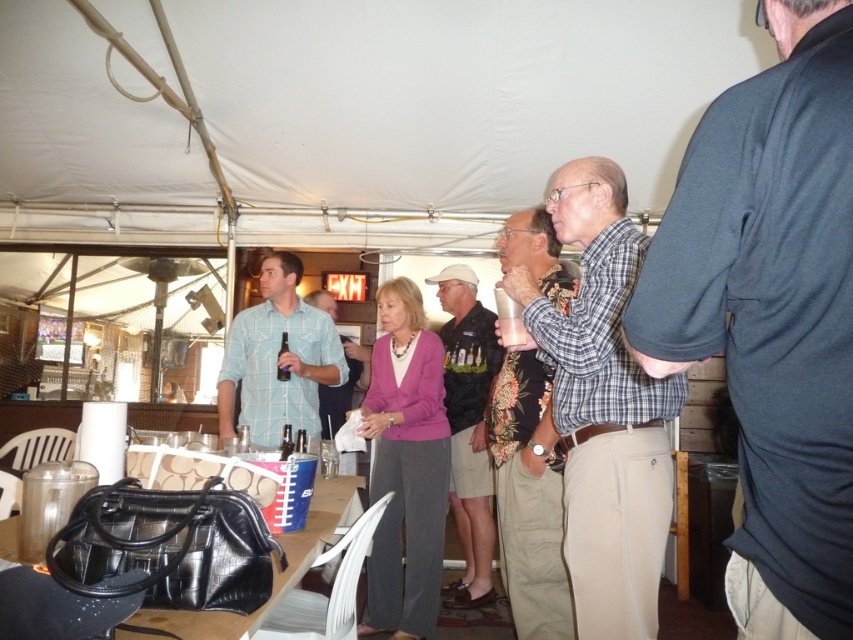
What is the position of the dark blue fabric shirt at right in the image?

The dark blue fabric shirt at right is located at point 0.492 on the x axis and 0.905 on the y axis.

You are a photographer at the event and need to adjust the lighting to ensure both the light blue plaid shirt at center and the dark gray cotton shirt at center are well lit. Based on their positions, which shirt should you focus the light on first to avoid shadows?

The light blue plaid shirt at center is located above the dark gray cotton shirt at center, so focusing the light on the light blue plaid shirt at center first will prevent its shadow from casting over the lower shirt.

You are at a party and want to hand a drink to both the person wearing the light blue plaid shirt at center and the dark gray cotton shirt at center. Which one should you approach first to ensure you can reach them without moving from your current spot?

You should approach the light blue plaid shirt at center first because it is closer to you than the dark gray cotton shirt at center, so you can reach them without moving.